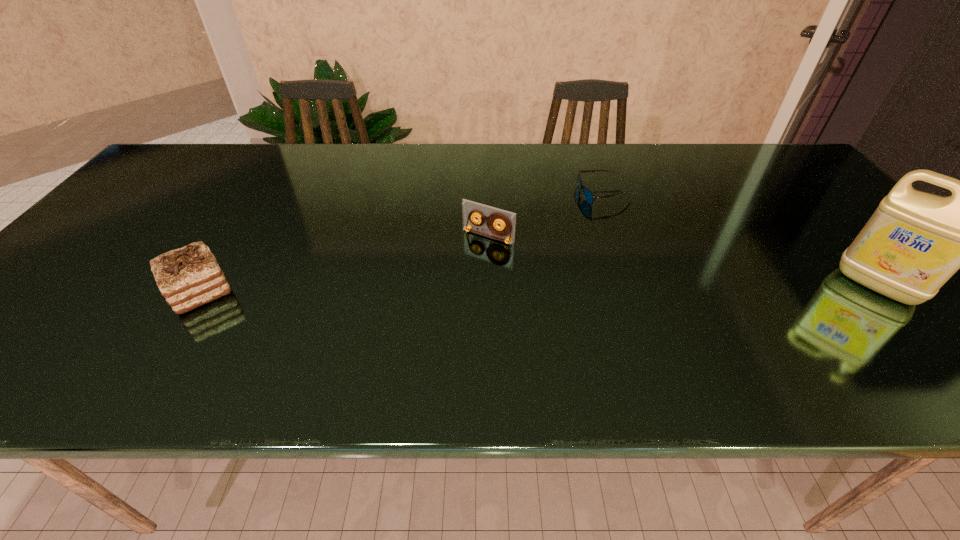
Where is `vacant space at the far edge`? vacant space at the far edge is located at coordinates (218, 164).

Image resolution: width=960 pixels, height=540 pixels. In order to click on vacant space at the near edge of the desktop in this screenshot , I will do `click(289, 315)`.

The width and height of the screenshot is (960, 540). In order to click on free location at the far right corner of the desktop in this screenshot , I will do `click(761, 144)`.

This screenshot has width=960, height=540. In the image, there is a desktop. In order to click on vacant region at the near right corner in this screenshot , I will do tap(934, 313).

Where is `unoccupied area between the third nearest object and the tallest object`? The image size is (960, 540). unoccupied area between the third nearest object and the tallest object is located at coordinates (683, 261).

Identify the location of free space between the sunglasses and the leftmost object. (402, 243).

Find the location of `vacant space in between the third nearest object and the tallest object`. vacant space in between the third nearest object and the tallest object is located at coordinates (683, 261).

The image size is (960, 540). In order to click on vacant region between the rightmost object and the third nearest object in this screenshot , I will do `click(683, 261)`.

Find the location of a particular element. Image resolution: width=960 pixels, height=540 pixels. free space between the chocolate cake and the videotape is located at coordinates (344, 264).

Find the location of a particular element. The image size is (960, 540). free space that is in between the shortest object and the detergent is located at coordinates (741, 240).